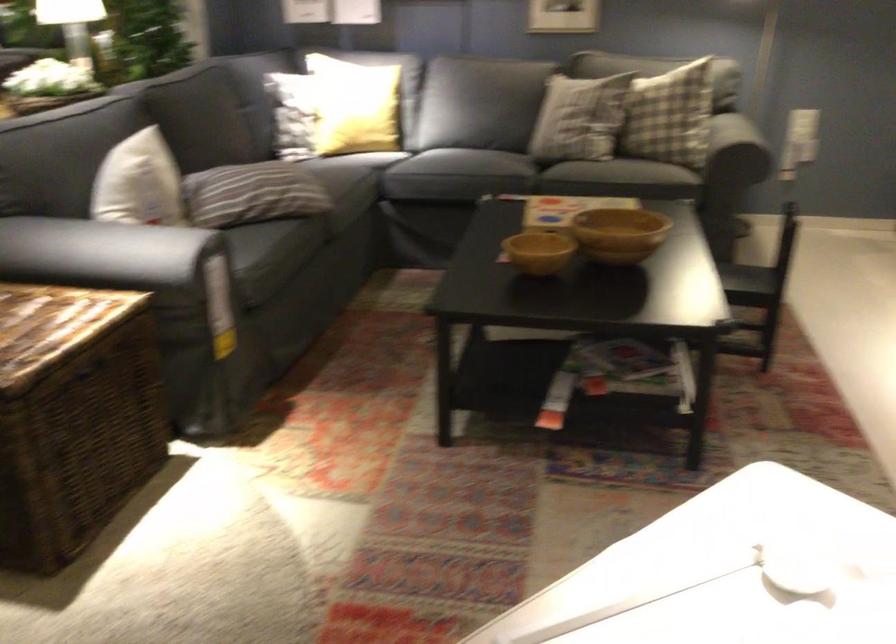
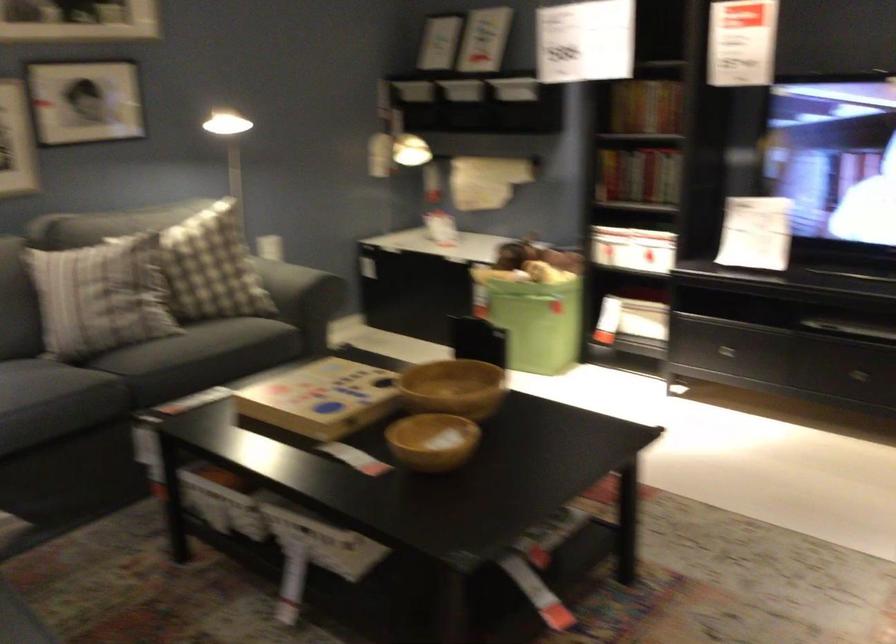
In the second image, find the point that corresponds to point 548,209 in the first image.

(320, 399)